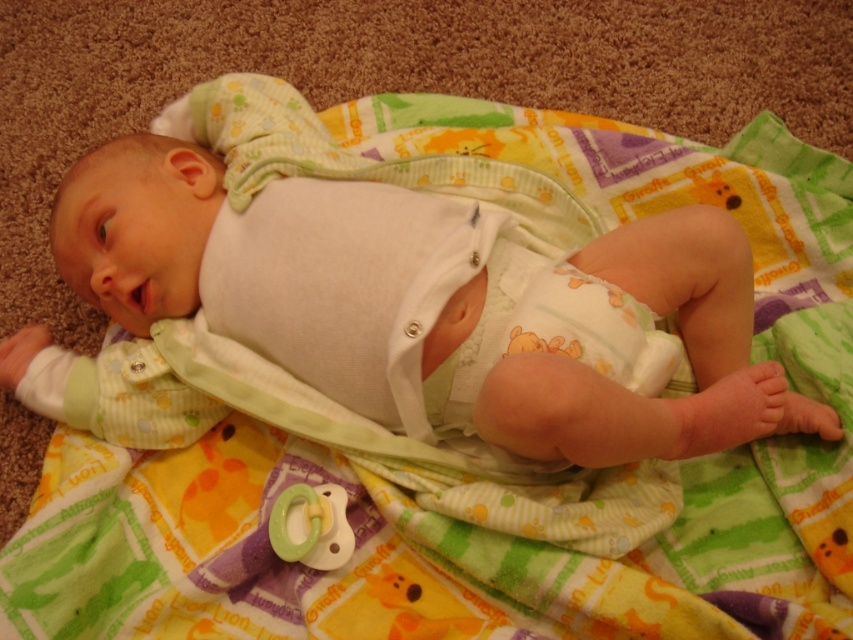
You are a parent holding a baby who is lying on a colorful blanket. The baby has a white soft diaper at center and a green rubber pacifier at center. Which item is closer to the baby?

The white soft diaper at center is in front of the green rubber pacifier at center, so the diaper is closer to the baby.

You are taking a photo of the baby and want to focus on the point at the bottom of the image. Which point between point (x=572, y=285) and point (x=312, y=496) is closer to the camera?

Point (x=572, y=285) is closer to the camera than point (x=312, y=496).

You are a pediatric nurse checking on a baby in the nursery. The baby is lying on a colorful blanket. You need to hand the green rubber pacifier at center to the white cotton baby at center. Can you reach the pacifier without moving the baby?

The white cotton baby at center and green rubber pacifier at center are 12.24 inches apart from each other. Since the distance is manageable, you can reach the pacifier without moving the baby.